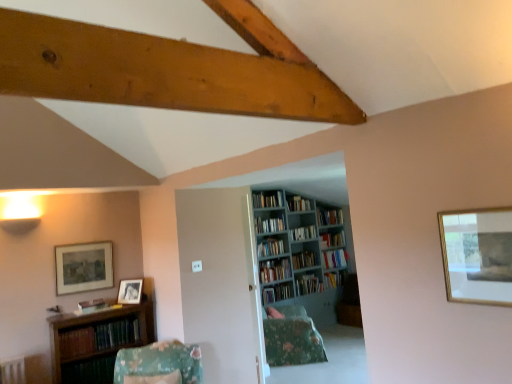
Question: Does matte wooden picture frame at left, which is the 2th picture frame in top-to-bottom order, have a greater width compared to hardcover book at center, positioned as the first book in back-to-front order?

Choices:
 (A) no
 (B) yes

Answer: (A)

Question: Is hardcover book at center, positioned as the first book in back-to-front order, at the back of matte wooden picture frame at left, marked as the second picture frame in a bottom-to-top arrangement?

Choices:
 (A) yes
 (B) no

Answer: (B)

Question: Does matte wooden picture frame at left, which appears as the second picture frame when viewed from the back, have a lesser width compared to hardcover book at center, positioned as the ninth book in front-to-back order?

Choices:
 (A) no
 (B) yes

Answer: (B)

Question: Is matte wooden picture frame at left, the 3th picture frame viewed from the right, outside hardcover book at center, positioned as the first book in back-to-front order?

Choices:
 (A) no
 (B) yes

Answer: (B)

Question: Is matte wooden picture frame at left, the second picture frame from the front, smaller than hardcover book at center, positioned as the ninth book in front-to-back order?

Choices:
 (A) yes
 (B) no

Answer: (A)

Question: From the image's perspective, is matte wooden picture frame at left, which is the 2th picture frame in top-to-bottom order, on top of hardcover book at center, positioned as the first book in back-to-front order?

Choices:
 (A) no
 (B) yes

Answer: (B)

Question: Is hardcover book at center, positioned as the 7th book in back-to-front order, behind hardcover books at center, which is counted as the 6th book, starting from the back?

Choices:
 (A) no
 (B) yes

Answer: (A)

Question: From a real-world perspective, is hardcover book at center, positioned as the 7th book in back-to-front order, over hardcover books at center, the 4th book from the front?

Choices:
 (A) yes
 (B) no

Answer: (B)

Question: Is hardcover book at center, positioned as the 7th book in back-to-front order, wider than hardcover books at center, which is counted as the 6th book, starting from the back?

Choices:
 (A) no
 (B) yes

Answer: (B)

Question: Is hardcover book at center, positioned as the 7th book in back-to-front order, turned away from hardcover books at center, which is counted as the 6th book, starting from the back?

Choices:
 (A) yes
 (B) no

Answer: (B)

Question: Is hardcover book at center, which is the third book in front-to-back order, at the right side of hardcover books at center, which is counted as the 6th book, starting from the back?

Choices:
 (A) no
 (B) yes

Answer: (B)

Question: Can we say hardcover book at center, positioned as the 7th book in back-to-front order, lies outside hardcover books at center, the 4th book from the front?

Choices:
 (A) yes
 (B) no

Answer: (A)

Question: From a real-world perspective, does matte wooden picture frame at left, the second picture frame from the front, stand above hardcover books at center, arranged as the 5th book when viewed from the front?

Choices:
 (A) no
 (B) yes

Answer: (B)